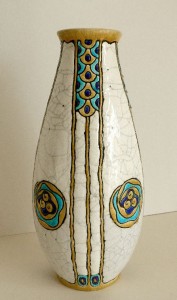
This screenshot has width=177, height=300. In order to click on bottom of vase in this screenshot , I will do `click(102, 287)`.